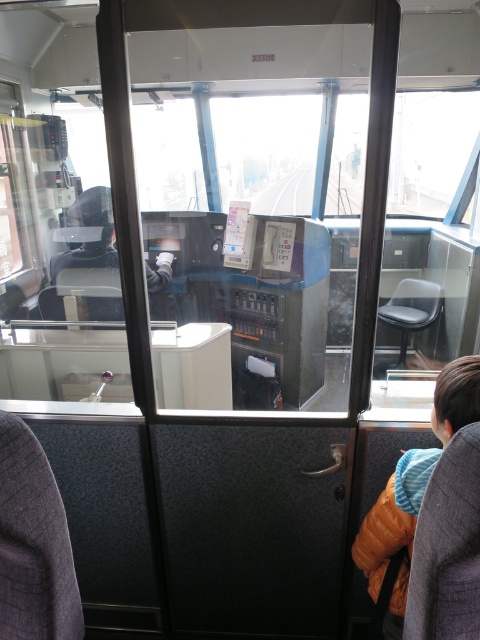
Question: Does orange puffer jacket at lower right have a smaller size compared to dark gray hoodie at center?

Choices:
 (A) yes
 (B) no

Answer: (A)

Question: Which point appears farthest from the camera in this image?

Choices:
 (A) pyautogui.click(x=431, y=464)
 (B) pyautogui.click(x=95, y=307)

Answer: (B)

Question: Which point is farther to the camera?

Choices:
 (A) (99, 209)
 (B) (360, 563)

Answer: (A)

Question: Considering the relative positions of orange puffer jacket at lower right and dark gray hoodie at center in the image provided, where is orange puffer jacket at lower right located with respect to dark gray hoodie at center?

Choices:
 (A) left
 (B) right

Answer: (B)

Question: Is orange puffer jacket at lower right thinner than dark gray hoodie at center?

Choices:
 (A) yes
 (B) no

Answer: (A)